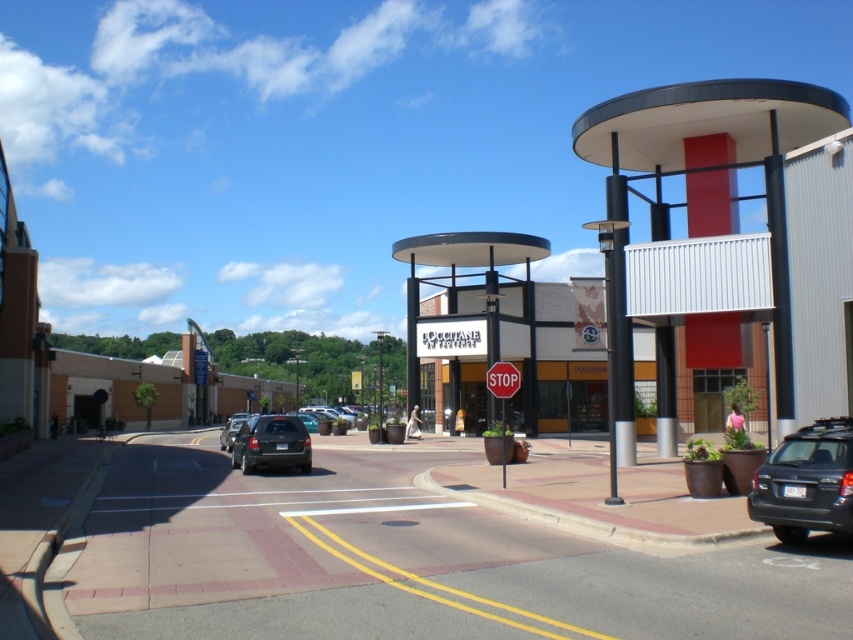
Can you confirm if matte black suv at lower right is positioned to the right of red matte stop sign at center?

Yes, matte black suv at lower right is to the right of red matte stop sign at center.

Find the location of a particular element. This screenshot has width=853, height=640. matte black suv at lower right is located at coordinates (805, 483).

Where is `matte black suv at lower right`? The image size is (853, 640). matte black suv at lower right is located at coordinates (805, 483).

You are a GUI agent. You are given a task and a screenshot of the screen. Output one action in this format:
    pyautogui.click(x=<x>, y=<y>)
    Task: Click on the white matte signboard at center
    This screenshot has width=853, height=640.
    Given the screenshot: What is the action you would take?
    pyautogui.click(x=550, y=360)

From the picture: Can you confirm if white matte signboard at center is positioned above black metallic pole at center-right?

No.

Is point (646, 352) positioned in front of point (613, 156)?

That is False.

What are the coordinates of `white matte signboard at center` in the screenshot? It's located at (550, 360).

Can you confirm if matte black suv at lower right is thinner than matte black suv at center-left?

Indeed, matte black suv at lower right has a lesser width compared to matte black suv at center-left.

Is point (817, 451) more distant than point (248, 467)?

No, (817, 451) is in front of (248, 467).

You are a GUI agent. You are given a task and a screenshot of the screen. Output one action in this format:
    pyautogui.click(x=<x>, y=<y>)
    Task: Click on the matte black suv at lower right
    Image resolution: width=853 pixels, height=640 pixels.
    Given the screenshot: What is the action you would take?
    805,483